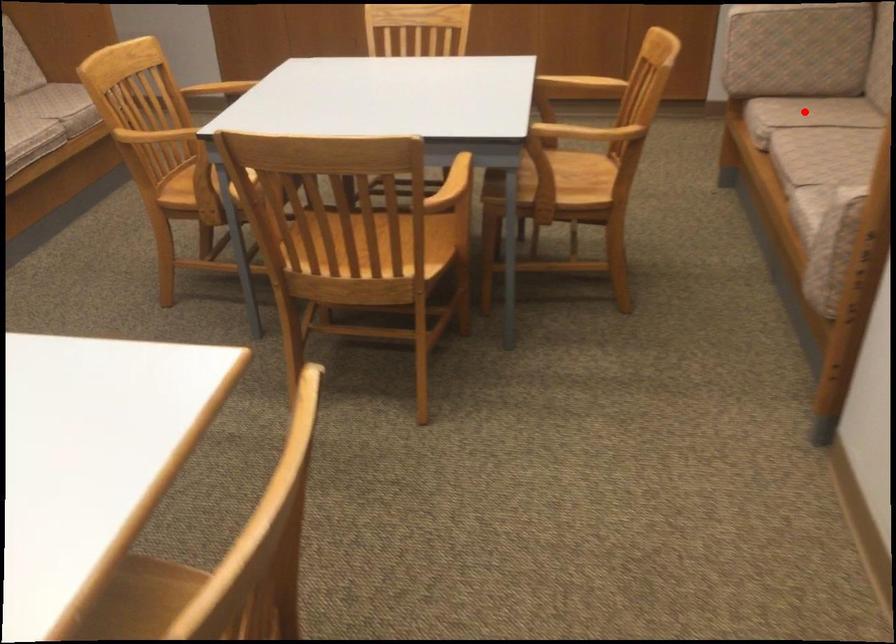
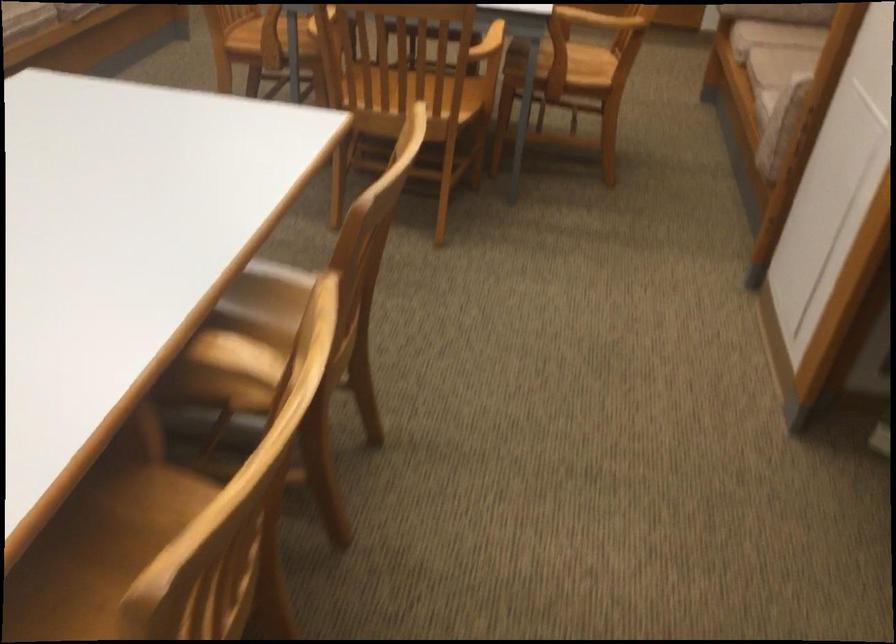
Find the pixel in the second image that matches the highlighted location in the first image.

(782, 33)